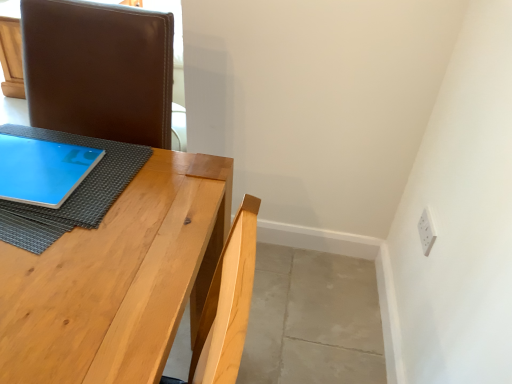
Question: Considering the positions of point click(x=167, y=314) and point click(x=34, y=228), is point click(x=167, y=314) closer or farther from the camera than point click(x=34, y=228)?

Choices:
 (A) farther
 (B) closer

Answer: (B)

Question: Looking at their shapes, would you say natural wood table at center is wider or thinner than blue fabric at upper left?

Choices:
 (A) thin
 (B) wide

Answer: (A)

Question: Based on their relative distances, which object is farther from the natural wood table at center?

Choices:
 (A) blue fabric at upper left
 (B) white plastic electric outlet at upper right
 (C) matte blue tablet at left

Answer: (B)

Question: Estimate the real-world distances between objects in this image. Which object is closer to the natural wood table at center?

Choices:
 (A) matte blue tablet at left
 (B) blue fabric at upper left
 (C) white plastic electric outlet at upper right

Answer: (B)